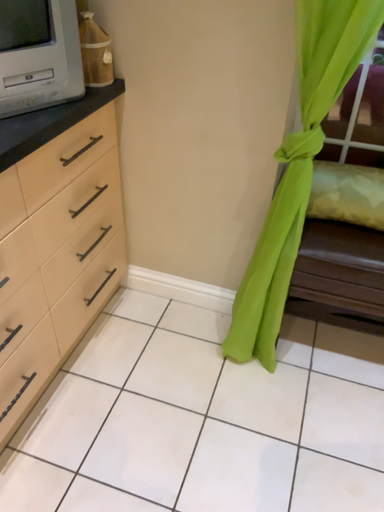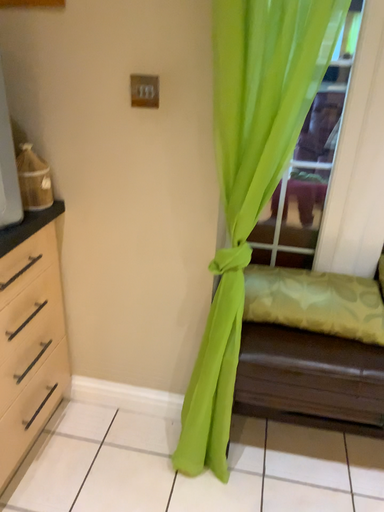
Question: How did the camera likely rotate when shooting the video?

Choices:
 (A) rotated upward
 (B) rotated downward

Answer: (A)